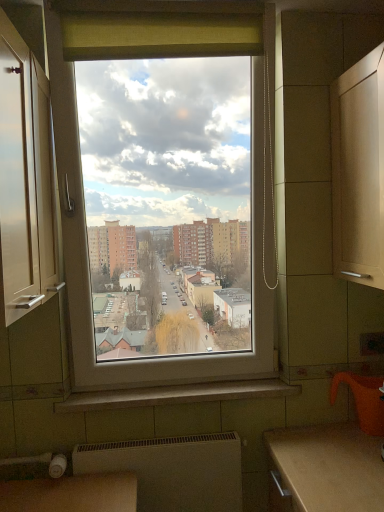
Question: From the image's perspective, is white glossy cabinet at left located above or below white glossy window sill at center?

Choices:
 (A) below
 (B) above

Answer: (B)

Question: Considering the positions of white glossy cabinet at left and white glossy window sill at center in the image, is white glossy cabinet at left wider or thinner than white glossy window sill at center?

Choices:
 (A) thin
 (B) wide

Answer: (B)

Question: Which object is the farthest from the white glossy cabinet at left?

Choices:
 (A) white glossy window sill at center
 (B) white matte radiator at lower center

Answer: (B)

Question: Which object is the farthest from the white glossy cabinet at left?

Choices:
 (A) white matte radiator at lower center
 (B) white glossy window sill at center

Answer: (A)